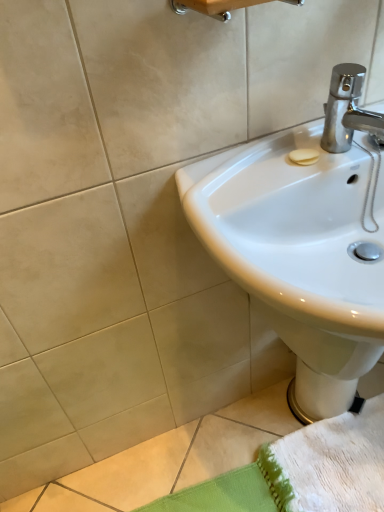
Question: Does white glossy sink at upper right have a smaller size compared to white glossy bidet at lower right?

Choices:
 (A) no
 (B) yes

Answer: (A)

Question: Does white glossy sink at upper right have a greater height compared to white glossy bidet at lower right?

Choices:
 (A) yes
 (B) no

Answer: (A)

Question: From a real-world perspective, is white glossy sink at upper right under white glossy bidet at lower right?

Choices:
 (A) no
 (B) yes

Answer: (A)

Question: Considering the relative sizes of white glossy sink at upper right and white glossy bidet at lower right in the image provided, is white glossy sink at upper right bigger than white glossy bidet at lower right?

Choices:
 (A) yes
 (B) no

Answer: (A)

Question: Considering the relative positions of white glossy sink at upper right and white glossy bidet at lower right in the image provided, is white glossy sink at upper right behind white glossy bidet at lower right?

Choices:
 (A) no
 (B) yes

Answer: (A)

Question: Can you confirm if white glossy sink at upper right is positioned to the right of white glossy bidet at lower right?

Choices:
 (A) yes
 (B) no

Answer: (B)

Question: From a real-world perspective, is white glossy bidet at lower right over wooden towel bar at upper center?

Choices:
 (A) yes
 (B) no

Answer: (B)

Question: Does white glossy bidet at lower right turn towards wooden towel bar at upper center?

Choices:
 (A) yes
 (B) no

Answer: (B)

Question: Considering the relative positions of white glossy bidet at lower right and wooden towel bar at upper center in the image provided, is white glossy bidet at lower right to the right of wooden towel bar at upper center from the viewer's perspective?

Choices:
 (A) yes
 (B) no

Answer: (A)

Question: From the image's perspective, is white glossy bidet at lower right on top of wooden towel bar at upper center?

Choices:
 (A) no
 (B) yes

Answer: (A)

Question: Is white glossy bidet at lower right outside of wooden towel bar at upper center?

Choices:
 (A) no
 (B) yes

Answer: (B)

Question: From the image's perspective, is white glossy bidet at lower right under wooden towel bar at upper center?

Choices:
 (A) no
 (B) yes

Answer: (B)

Question: From the image's perspective, is wooden towel bar at upper center above white glossy sink at upper right?

Choices:
 (A) yes
 (B) no

Answer: (A)